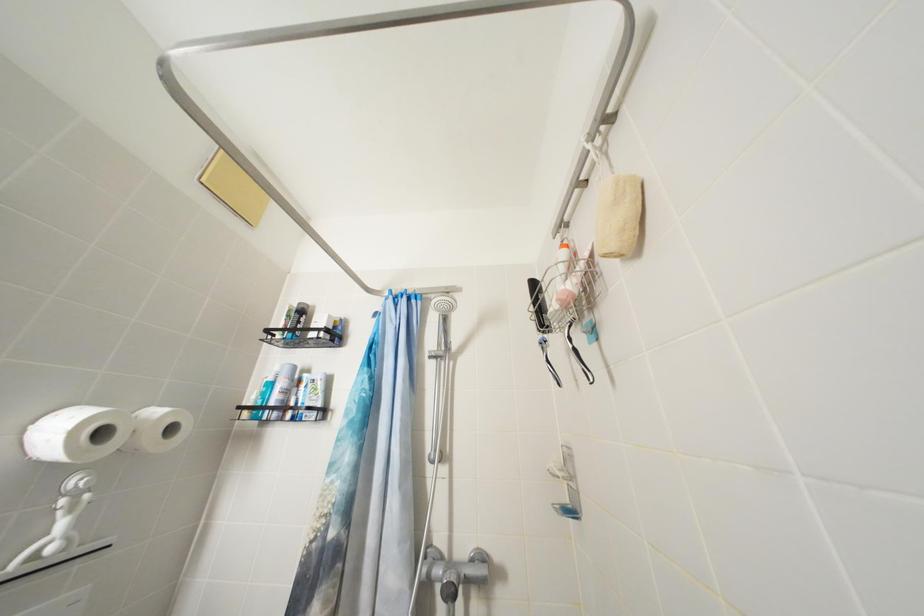
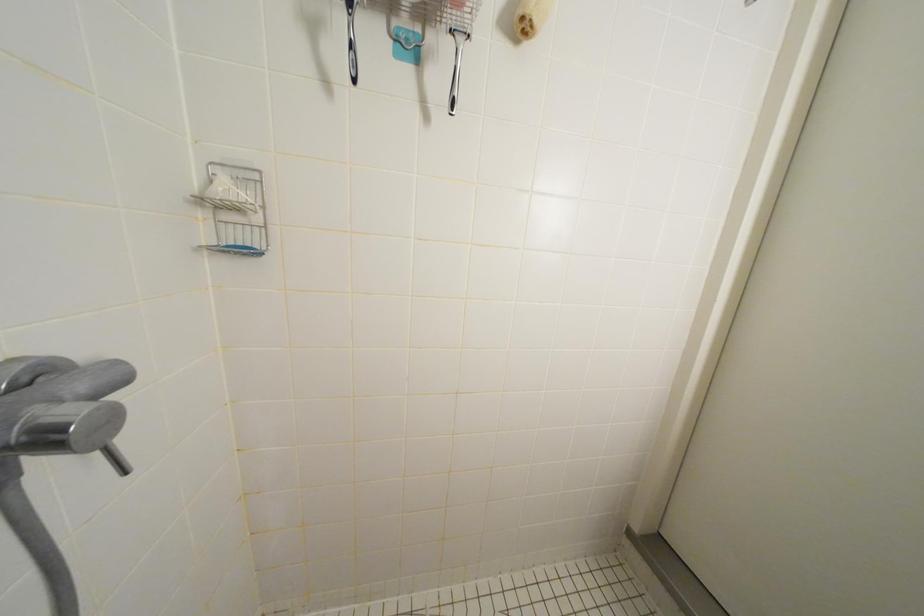
Question: How did the camera likely rotate?

Choices:
 (A) Left
 (B) Right
 (C) Up
 (D) Down

Answer: (B)